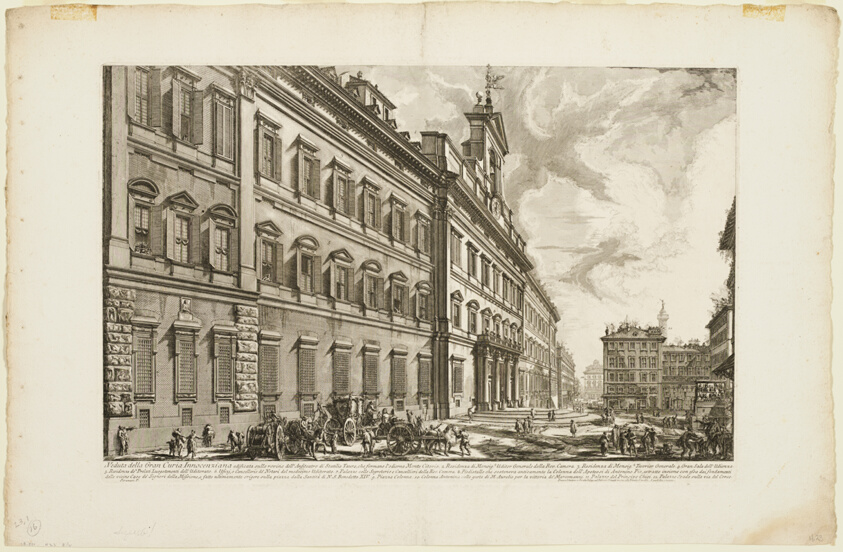
Locate an element on the screen. window is located at coordinates (223, 254), (303, 266), (368, 286), (371, 212).